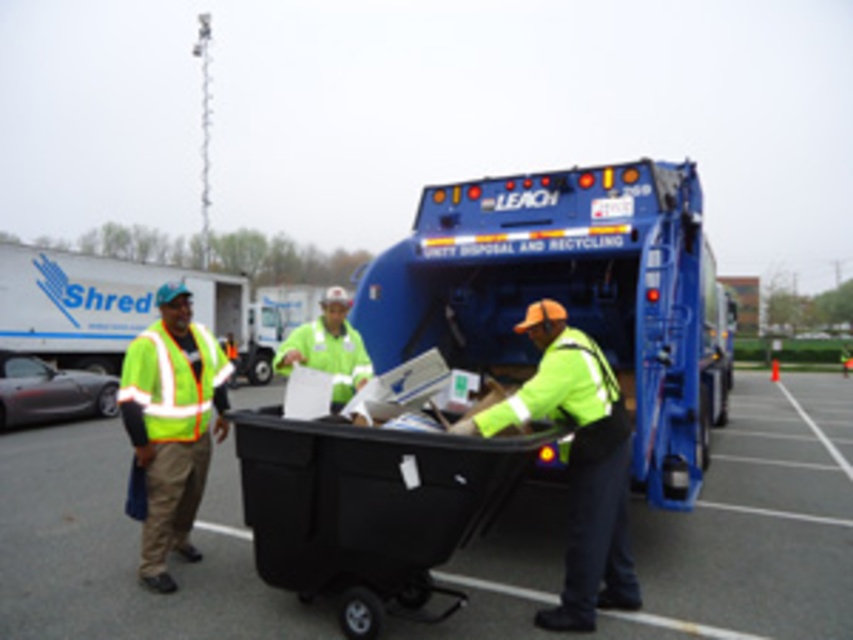
Measure the distance between high-visibility yellow safety vest at left and green reflective vest at center.

A distance of 4.48 meters exists between high-visibility yellow safety vest at left and green reflective vest at center.

Can you confirm if high-visibility yellow safety vest at left is thinner than green reflective vest at center?

Yes, high-visibility yellow safety vest at left is thinner than green reflective vest at center.

What do you see at coordinates (171, 385) in the screenshot? I see `high-visibility yellow safety vest at left` at bounding box center [171, 385].

The width and height of the screenshot is (853, 640). I want to click on high-visibility yellow safety vest at left, so click(171, 385).

Who is higher up, black plastic bin at center or blue metallic garbage truck at center?

Positioned higher is blue metallic garbage truck at center.

In order to click on black plastic bin at center in this screenshot , I will do `click(123, 550)`.

Identify the location of high-visibility fabric worker at left. This screenshot has height=640, width=853. (170, 428).

Is high-visibility fabric worker at left taller than high-visibility yellow safety vest at left?

Yes, high-visibility fabric worker at left is taller than high-visibility yellow safety vest at left.

Who is more forward, (200, 492) or (158, 353)?

Point (158, 353) is more forward.

Image resolution: width=853 pixels, height=640 pixels. Identify the location of high-visibility fabric worker at left. (170, 428).